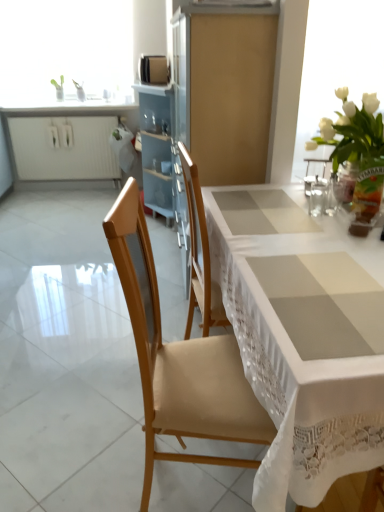
Image resolution: width=384 pixels, height=512 pixels. I want to click on vacant point above white matte cabinet at upper left (from a real-world perspective), so click(71, 113).